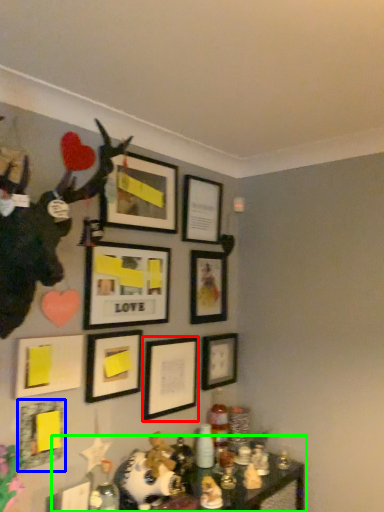
Question: Estimate the real-world distances between objects in this image. Which object is closer to picture frame (highlighted by a red box), picture frame (highlighted by a blue box) or table (highlighted by a green box)?

Choices:
 (A) picture frame
 (B) table

Answer: (B)